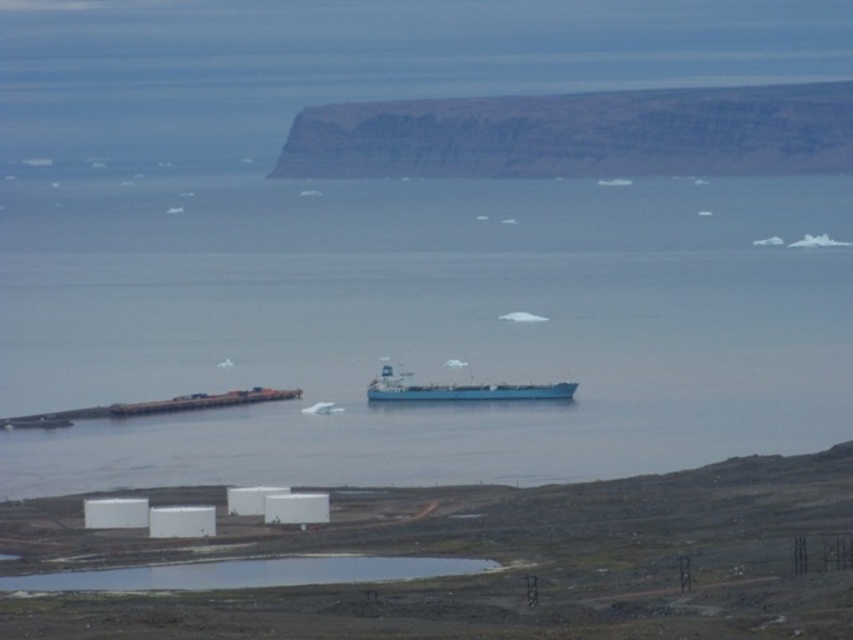
In the scene shown: You are a sailor on a boat and you see the rocky cliff at upper center and the blue matte ship at center. Which object is wider from your perspective?

The rocky cliff at upper center might be wider than the blue matte ship at center.

You are a sailor navigating a ship in the coastal scene. You notice a point marked at coordinates (578,134). What significant landmark does this point indicate?

The point at coordinates (578,134) marks the location of the rocky cliff at upper center.

You are a sailor on a ship and need to navigate around the blue water at center and the rocky cliff at upper center. Which object is positioned higher in the image?

The rocky cliff at upper center is positioned higher than the blue water at center, as it is located above it in the scene.